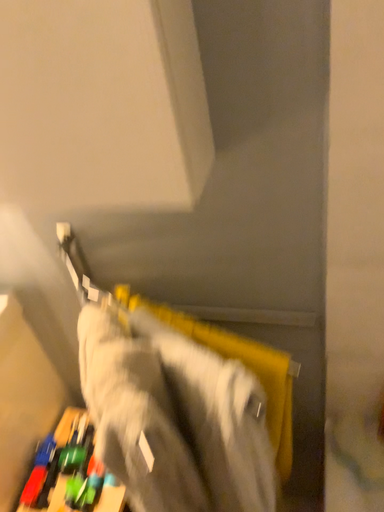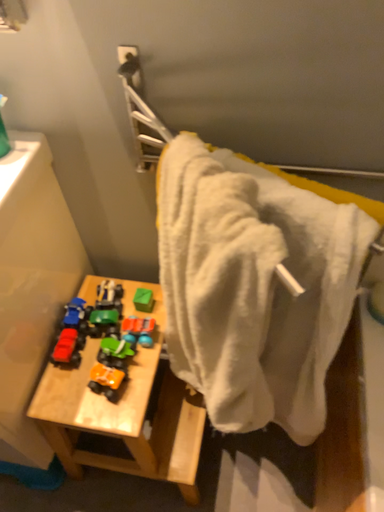
Question: Which way did the camera rotate in the video?

Choices:
 (A) rotated left
 (B) rotated right

Answer: (B)